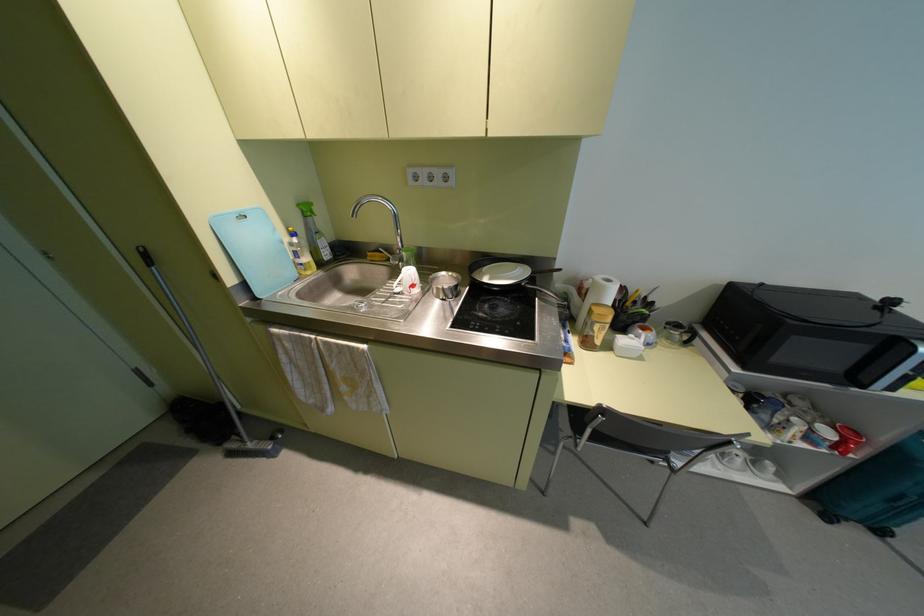
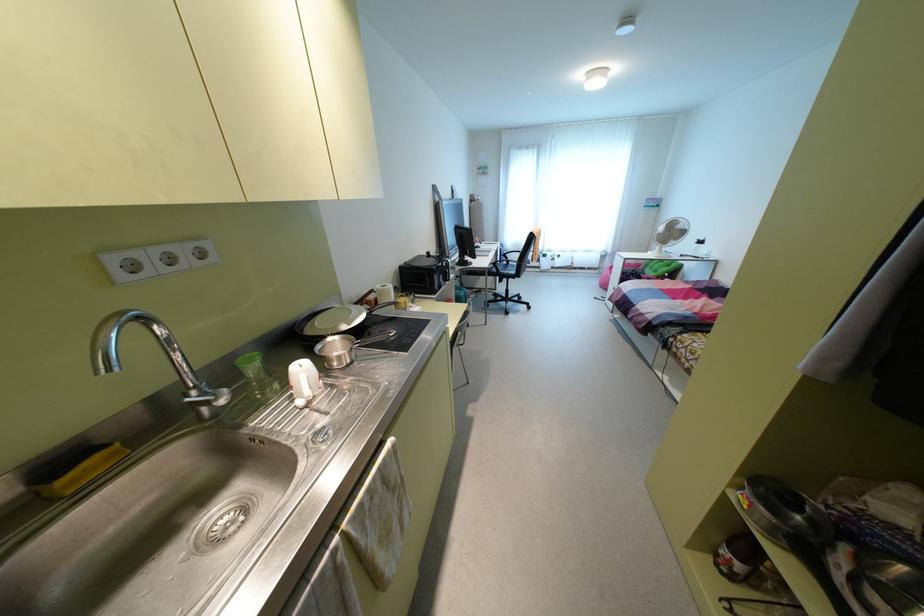
Find the pixel in the second image that matches pixel 490 278 in the first image.

(348, 323)